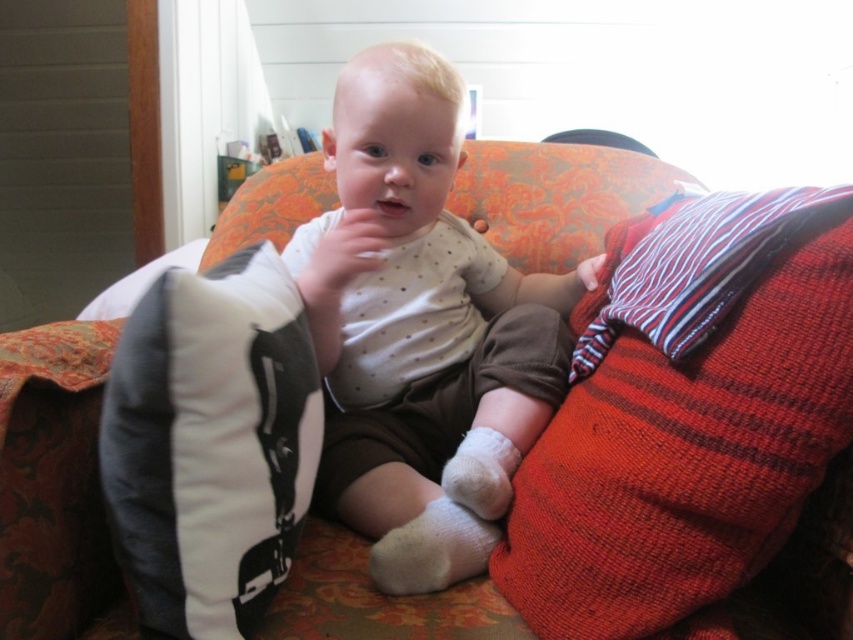
You are a photographer positioned in front of the couch where the baby is sitting. You want to take a closeup shot of the baby without including the red knitted blanket at right in the frame. Based on the distance provided, can you estimate if you can move closer to the baby to achieve this?

The red knitted blanket at right is 23.35 inches away from the viewer. If you move closer to the baby, the distance to the blanket will decrease. However, since the blanket is already at that distance, moving closer might bring the baby into focus while the blanket could be out of frame depending on the camera angle and lens used. The exact feasibility depends on the camera equipment and framing adjustments.

You are a photographer setting up a shot of the baby on the couch. The red knitted blanket at right is important for the composition. Where should you position your camera to ensure the blanket is in the frame?

Position the camera so that it captures the area around the coordinates 0.652 on the x and 0.807 on the y axis, where the red knitted blanket at right is located.

You are a photographer setting up for a baby photo shoot. You need to ensure the white soft baby at center is framed properly. Since the red knitted blanket at right is part of the setup, how does its height compare to the baby?

The red knitted blanket at right is not as tall as the white soft baby at center, so the blanket will appear shorter in the photo.